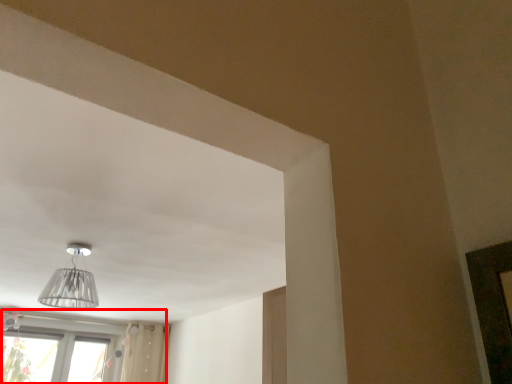
Question: From the image's perspective, what is the correct spatial relationship of window (annotated by the red box) in relation to lamp?

Choices:
 (A) above
 (B) below

Answer: (B)